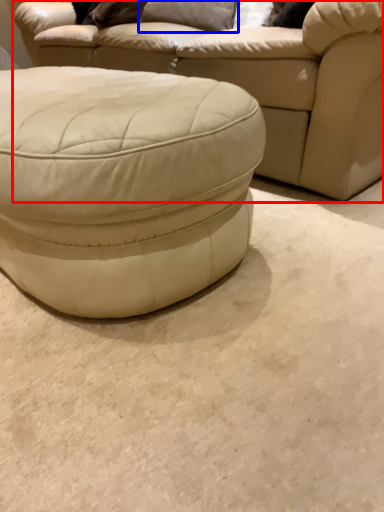
Question: Which point is closer to the camera, studio couch (highlighted by a red box) or pillow (highlighted by a blue box)?

Choices:
 (A) studio couch
 (B) pillow

Answer: (A)